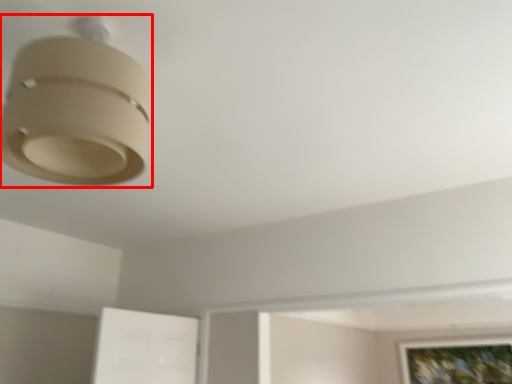
Question: In this image, where is lamp (annotated by the red box) located relative to picture frame?

Choices:
 (A) left
 (B) right

Answer: (A)